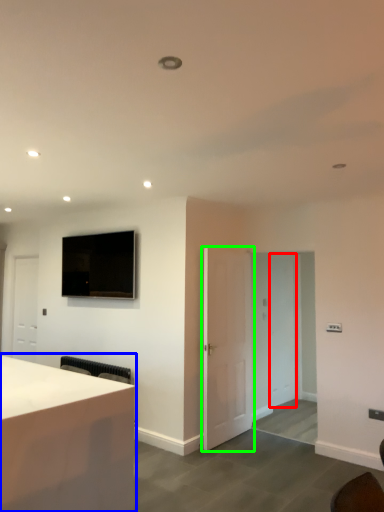
Question: Based on their relative distances, which object is farther from glass door (highlighted by a red box)? Choose from desk (highlighted by a blue box) and door (highlighted by a green box).

Choices:
 (A) desk
 (B) door

Answer: (A)